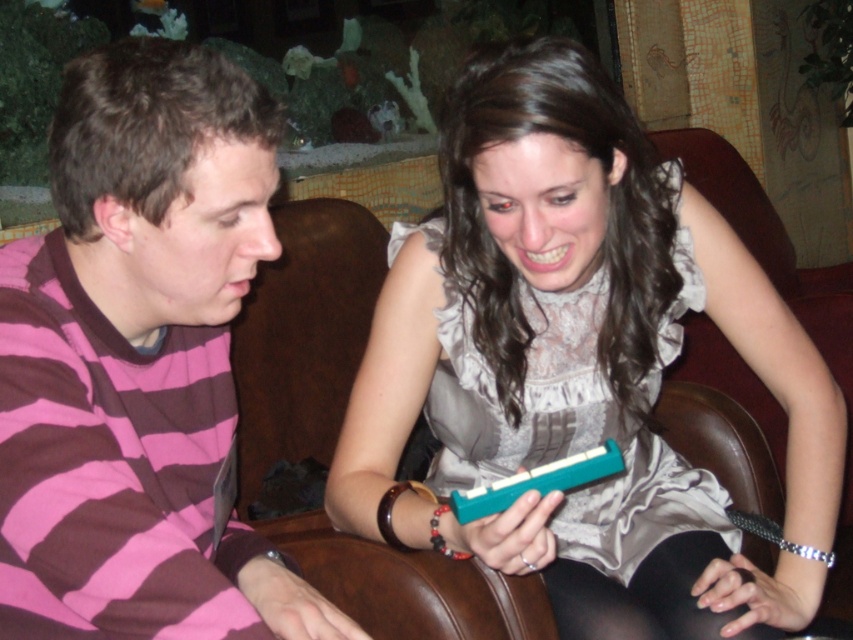
Question: Which of the following is the closest to the observer?

Choices:
 (A) (192, 620)
 (B) (474, 444)

Answer: (A)

Question: Which point appears closest to the camera in this image?

Choices:
 (A) (537, 417)
 (B) (171, 609)

Answer: (B)

Question: Where is teal plastic harmonica at center located in relation to pink striped shirt at left in the image?

Choices:
 (A) above
 (B) below

Answer: (B)

Question: Is teal plastic harmonica at center further to camera compared to pink striped shirt at left?

Choices:
 (A) no
 (B) yes

Answer: (B)

Question: Is teal plastic harmonica at center above pink striped shirt at left?

Choices:
 (A) yes
 (B) no

Answer: (B)

Question: Which of the following is the farthest from the observer?

Choices:
 (A) (440, 440)
 (B) (26, 403)

Answer: (A)